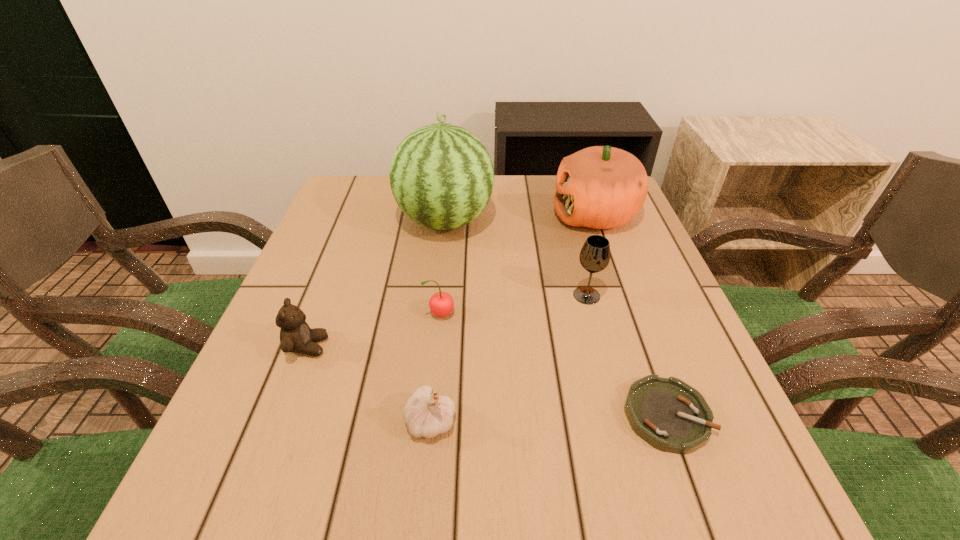
Identify the location of object that is at the left edge. This screenshot has width=960, height=540. (296, 336).

You are a GUI agent. You are given a task and a screenshot of the screen. Output one action in this format:
    pyautogui.click(x=<x>, y=<y>)
    Task: Click on the pumpkin located in the right edge section of the desktop
    
    Given the screenshot: What is the action you would take?
    pyautogui.click(x=601, y=187)

You are a GUI agent. You are given a task and a screenshot of the screen. Output one action in this format:
    pyautogui.click(x=<x>, y=<y>)
    Task: Click on the wineglass located in the right edge section of the desktop
    Image resolution: width=960 pixels, height=540 pixels.
    Given the screenshot: What is the action you would take?
    pyautogui.click(x=594, y=257)

In order to click on ashtray present at the right edge in this screenshot , I will do `click(670, 415)`.

I want to click on object that is positioned at the far right corner, so coord(601,187).

Image resolution: width=960 pixels, height=540 pixels. In the image, there is a desktop. What are the coordinates of `vacant space at the near edge` in the screenshot? It's located at (360, 489).

Identify the location of free point at the left edge. The width and height of the screenshot is (960, 540). (254, 457).

Identify the location of free location at the right edge of the desktop. This screenshot has height=540, width=960. (634, 264).

At what (x,y) coordinates should I click in order to perform the action: click on vacant region at the far left corner of the desktop. Please return your answer as a coordinate pair (x, y). Looking at the image, I should click on (385, 184).

This screenshot has width=960, height=540. I want to click on vacant region at the near left corner of the desktop, so click(x=284, y=494).